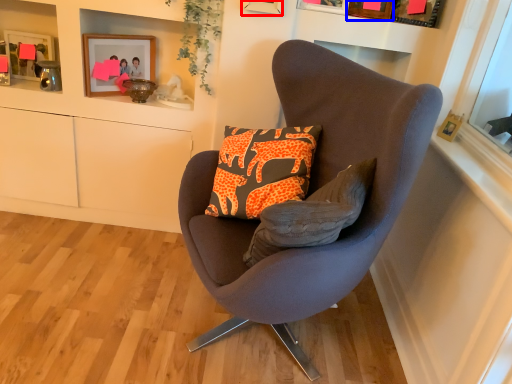
Question: Which point is further to the camera, picture frame (highlighted by a red box) or picture frame (highlighted by a blue box)?

Choices:
 (A) picture frame
 (B) picture frame

Answer: (B)